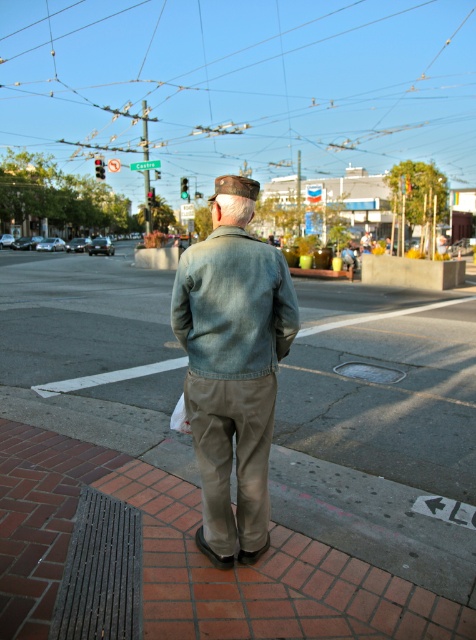
Who is positioned more to the left, denim jacket at center or faded denim jacket at lower right?

Positioned to the left is faded denim jacket at lower right.

Which of these two, denim jacket at center or faded denim jacket at lower right, stands shorter?

denim jacket at center

Who is more forward, [228,564] or [251,356]?

Point [251,356] is in front.

Identify the location of denim jacket at center. pyautogui.click(x=232, y=365).

Measure the distance between point (400, 556) and camera.

Point (400, 556) and camera are 2.92 meters apart.

Is point (405, 548) behind point (259, 342)?

Yes.

Does point (276, 420) lie behind point (255, 298)?

Yes, point (276, 420) is behind point (255, 298).

This screenshot has height=640, width=476. What are the coordinates of `brown brick pavement at center` in the screenshot? It's located at (382, 429).

Does brown brick pavement at center appear on the left side of faded denim jacket at lower right?

In fact, brown brick pavement at center is to the right of faded denim jacket at lower right.

Is brown brick pavement at center below faded denim jacket at lower right?

No, brown brick pavement at center is not below faded denim jacket at lower right.

Is point (125, 307) positioned behind point (188, 317)?

Yes.

You are a GUI agent. You are given a task and a screenshot of the screen. Output one action in this format:
    pyautogui.click(x=<x>, y=<y>)
    Task: Click on the brown brick pavement at center
    This screenshot has height=640, width=476.
    Given the screenshot: What is the action you would take?
    pyautogui.click(x=382, y=429)